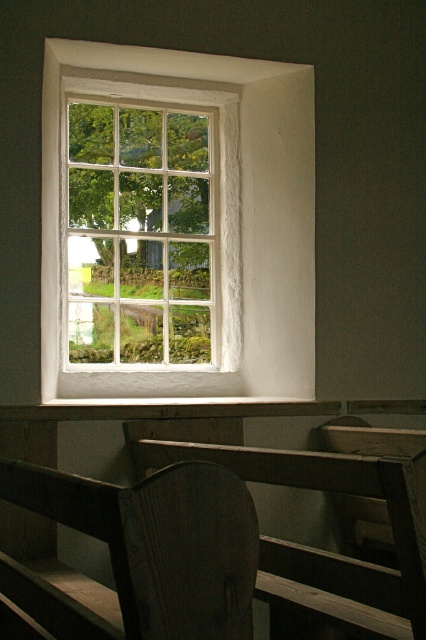
You are standing at the entrance of the room and want to sit on the wooden bench at lower left. Based on its coordinates, is the bench closer to the wall or the window?

The wooden bench at lower left is positioned at coordinates point (216, 547), which places it closer to the wall than the window.

You are standing in the room and looking at the two points marked in the image. Which point, point (255, 141) or point (193, 360), is closer to you?

Point (255, 141) is closer to you than point (193, 360).